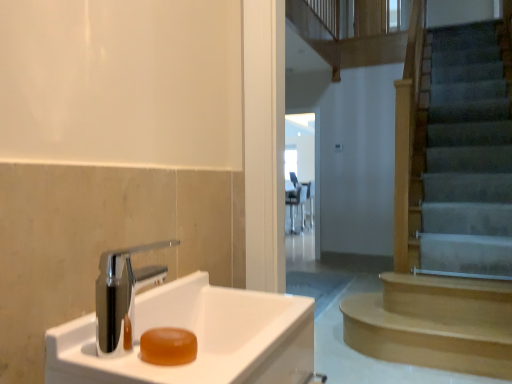
Question: Does translucent amber soap at sink left have a lesser width compared to transparent glass door at center?

Choices:
 (A) yes
 (B) no

Answer: (A)

Question: Considering the relative positions of translucent amber soap at sink left and transparent glass door at center in the image provided, is translucent amber soap at sink left in front of transparent glass door at center?

Choices:
 (A) no
 (B) yes

Answer: (B)

Question: Does translucent amber soap at sink left have a greater height compared to transparent glass door at center?

Choices:
 (A) yes
 (B) no

Answer: (B)

Question: Considering the relative positions of translucent amber soap at sink left and transparent glass door at center in the image provided, is translucent amber soap at sink left to the left of transparent glass door at center from the viewer's perspective?

Choices:
 (A) no
 (B) yes

Answer: (B)

Question: From a real-world perspective, does translucent amber soap at sink left sit lower than transparent glass door at center?

Choices:
 (A) yes
 (B) no

Answer: (A)

Question: Looking at the image, does translucent amber soap at sink left seem bigger or smaller compared to light brown wooden stairs at right?

Choices:
 (A) small
 (B) big

Answer: (A)

Question: Considering the positions of translucent amber soap at sink left and light brown wooden stairs at right in the image, is translucent amber soap at sink left wider or thinner than light brown wooden stairs at right?

Choices:
 (A) thin
 (B) wide

Answer: (A)

Question: Is translucent amber soap at sink left taller or shorter than light brown wooden stairs at right?

Choices:
 (A) short
 (B) tall

Answer: (A)

Question: Considering their positions, is translucent amber soap at sink left located in front of or behind light brown wooden stairs at right?

Choices:
 (A) behind
 (B) front

Answer: (B)

Question: Considering the positions of transparent glass door at center and light brown wooden stairs at right in the image, is transparent glass door at center bigger or smaller than light brown wooden stairs at right?

Choices:
 (A) big
 (B) small

Answer: (B)

Question: From the image's perspective, relative to light brown wooden stairs at right, is transparent glass door at center above or below?

Choices:
 (A) above
 (B) below

Answer: (A)

Question: From a real-world perspective, is transparent glass door at center above or below light brown wooden stairs at right?

Choices:
 (A) below
 (B) above

Answer: (B)

Question: Is transparent glass door at center in front of or behind light brown wooden stairs at right in the image?

Choices:
 (A) behind
 (B) front

Answer: (A)

Question: In terms of size, does transparent glass door at center appear bigger or smaller than white glossy sink at lower left?

Choices:
 (A) small
 (B) big

Answer: (B)

Question: Relative to white glossy sink at lower left, is transparent glass door at center in front or behind?

Choices:
 (A) behind
 (B) front

Answer: (A)